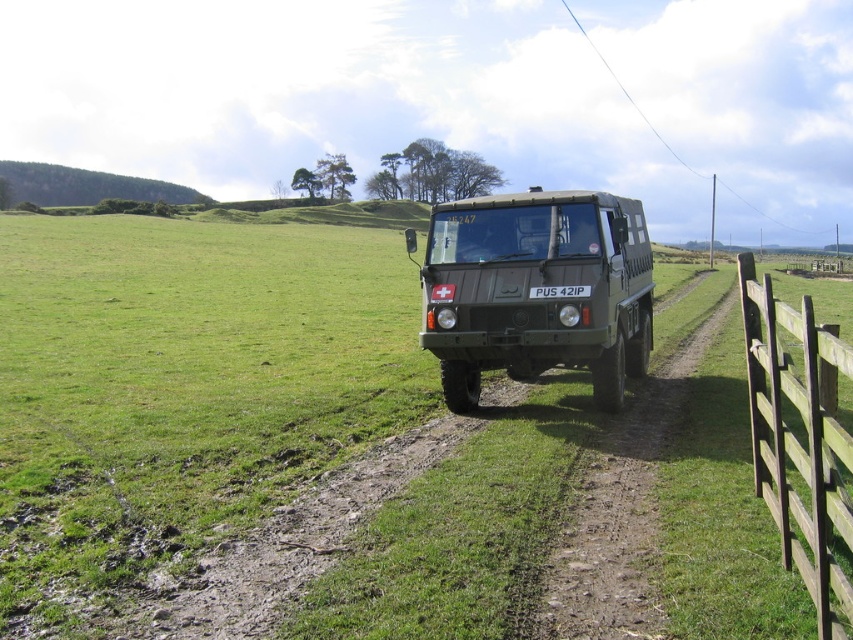
You are a photographer trying to capture the matte green truck at center and the brown wooden fence at right in the same frame. Based on their heights, which object will appear larger in the photo?

The matte green truck at center will appear larger in the photo because it has a greater height compared to the brown wooden fence at right.

Consider the image. You are a photographer positioned on the side of the dirt path. You want to take a photo that clearly shows both the matte green truck at center and the white plastic license plate at center. Which object should you focus on first to ensure both are in focus?

You should focus on the matte green truck at center first because it is closer to the viewer than the white plastic license plate at center, so focusing on the closer object will ensure the license plate remains in focus as well.

You are a photographer trying to capture the white plastic license plate at center and the brown wooden fence at right in a single frame. Given that the fence is larger than the license plate, how should you position your camera to ensure both are clearly visible?

Since the brown wooden fence at right is larger in size than the white plastic license plate at center, position the camera closer to the license plate to balance their sizes in the frame.